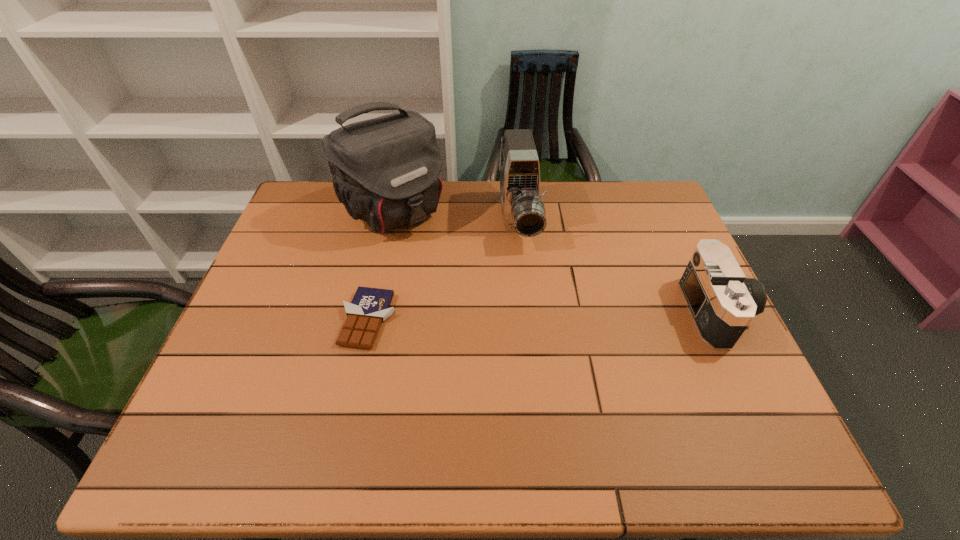
Locate an element on the screen. vacant region located on the open flap of the tallest object is located at coordinates (441, 260).

Find the location of a particular element. The width and height of the screenshot is (960, 540). free space located on the open flap of the tallest object is located at coordinates (503, 325).

I want to click on vacant space located on the open flap of the tallest object, so click(x=472, y=293).

Identify the location of camcorder situated at the far edge. This screenshot has height=540, width=960. (523, 211).

At what (x,y) coordinates should I click in order to perform the action: click on shoulder bag that is at the far edge. Please return your answer as a coordinate pair (x, y). The image size is (960, 540). Looking at the image, I should click on (385, 170).

Identify the location of object present at the left edge. The height and width of the screenshot is (540, 960). (385, 170).

Locate an element on the screen. object that is at the right edge is located at coordinates (722, 302).

This screenshot has height=540, width=960. I want to click on object present at the far left corner, so click(385, 170).

The width and height of the screenshot is (960, 540). What are the coordinates of `vacant space at the far edge` in the screenshot? It's located at (588, 196).

At what (x,y) coordinates should I click in order to perform the action: click on vacant region at the near edge. Please return your answer as a coordinate pair (x, y). Looking at the image, I should click on (311, 399).